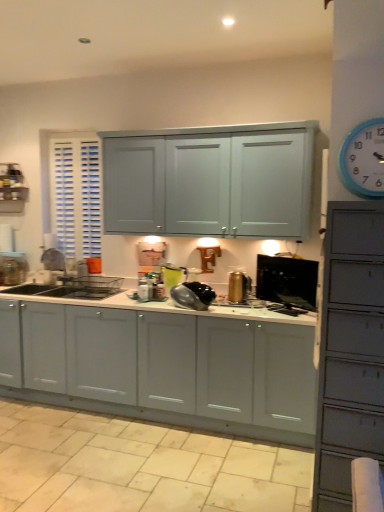
Question: From the image's perspective, does black glossy monitor at center, which is the 1th appliance from right to left, appear lower than matte white cabinets at center?

Choices:
 (A) no
 (B) yes

Answer: (A)

Question: Is black glossy monitor at center, which is the 1th appliance from right to left, not within matte white cabinets at center?

Choices:
 (A) yes
 (B) no

Answer: (A)

Question: Is black glossy monitor at center, arranged as the fourth appliance when viewed from the left, not close to matte white cabinets at center?

Choices:
 (A) yes
 (B) no

Answer: (B)

Question: Is black glossy monitor at center, arranged as the fourth appliance when viewed from the left, closer to camera compared to matte white cabinets at center?

Choices:
 (A) yes
 (B) no

Answer: (B)

Question: Can you confirm if black glossy monitor at center, which is the 1th appliance from right to left, is bigger than matte white cabinets at center?

Choices:
 (A) no
 (B) yes

Answer: (A)

Question: Is black glossy monitor at center, arranged as the fourth appliance when viewed from the left, oriented towards matte white cabinets at center?

Choices:
 (A) yes
 (B) no

Answer: (B)

Question: Are gold metallic kettle at center, positioned as the third appliance in left-to-right order, and beige tile at lower center beside each other?

Choices:
 (A) no
 (B) yes

Answer: (A)

Question: From a real-world perspective, is gold metallic kettle at center, positioned as the third appliance in left-to-right order, positioned over beige tile at lower center based on gravity?

Choices:
 (A) no
 (B) yes

Answer: (B)

Question: From a real-world perspective, is gold metallic kettle at center, positioned as the third appliance in left-to-right order, under beige tile at lower center?

Choices:
 (A) yes
 (B) no

Answer: (B)

Question: Does gold metallic kettle at center, the second appliance positioned from the right, appear on the left side of beige tile at lower center?

Choices:
 (A) no
 (B) yes

Answer: (A)

Question: Is gold metallic kettle at center, positioned as the third appliance in left-to-right order, looking in the opposite direction of beige tile at lower center?

Choices:
 (A) yes
 (B) no

Answer: (B)

Question: Is gold metallic kettle at center, the second appliance positioned from the right, wider than beige tile at lower center?

Choices:
 (A) yes
 (B) no

Answer: (B)

Question: Is black glossy monitor at center, which is the 1th appliance from right to left, surrounded by shiny metallic kettle at center, the second appliance viewed from the left?

Choices:
 (A) no
 (B) yes

Answer: (A)